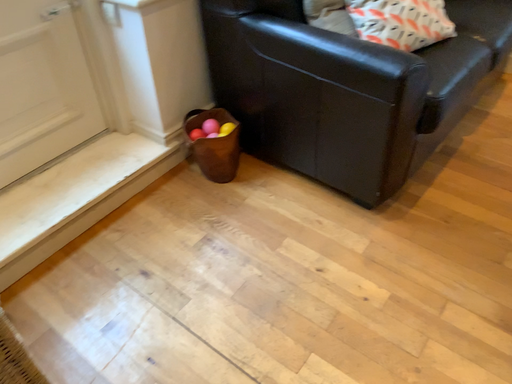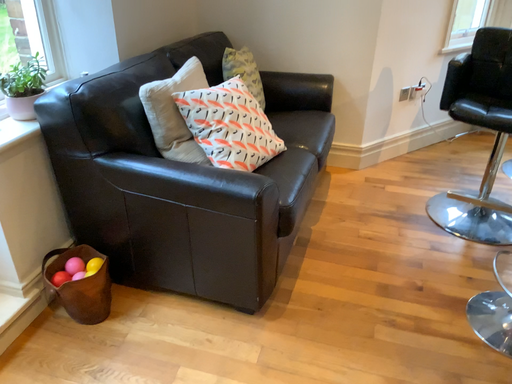
Question: Which way did the camera rotate in the video?

Choices:
 (A) rotated downward
 (B) rotated upward

Answer: (B)